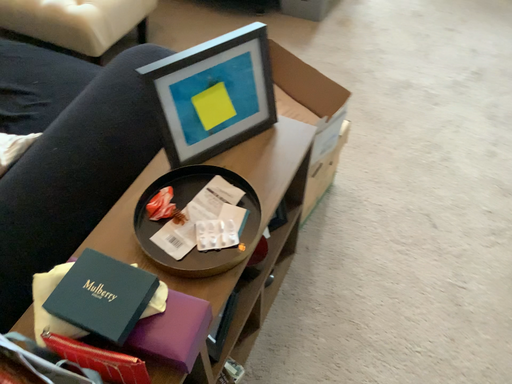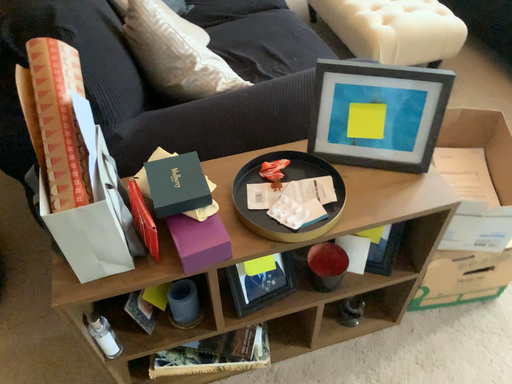
Question: How did the camera likely rotate when shooting the video?

Choices:
 (A) rotated upward
 (B) rotated downward

Answer: (A)